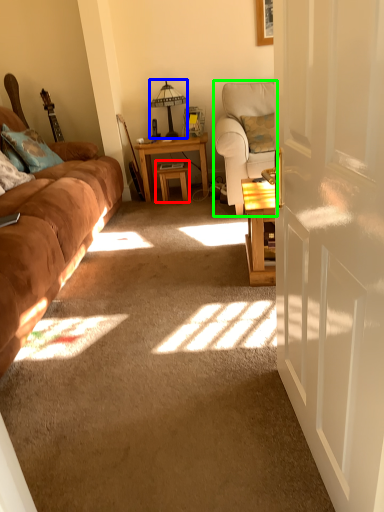
Question: Considering the real-world distances, which object is closest to table (highlighted by a red box)? table lamp (highlighted by a blue box) or chair (highlighted by a green box).

Choices:
 (A) table lamp
 (B) chair

Answer: (A)